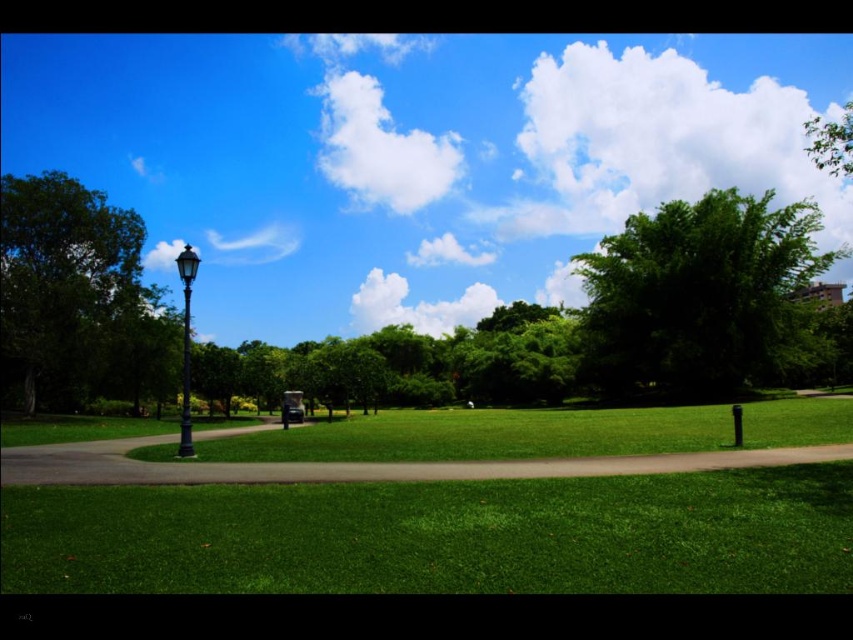
You are a painter setting up your easel in the park. You want to capture the blue sky at upper center and the polished blue glass lamp post at left in your painting. Which object is located to the right of the other?

The blue sky at upper center is positioned on the right side of the polished blue glass lamp post at left.

You are standing at the point marked as point (410, 156) in the park. Looking up, what do you see above you?

Above point (410, 156), you will see the blue sky at upper center.